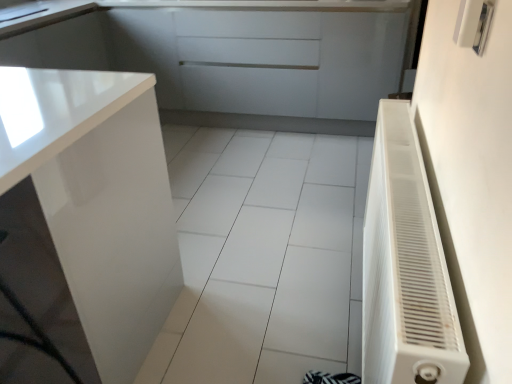
Question: Would you say glossy white cabinet at upper left, marked as the first cabinetry in a back-to-front arrangement, is to the left or to the right of metallic silver switch at upper right in the picture?

Choices:
 (A) right
 (B) left

Answer: (B)

Question: Based on their sizes in the image, would you say glossy white cabinet at upper left, placed as the 2th cabinetry when sorted from front to back, is bigger or smaller than metallic silver switch at upper right?

Choices:
 (A) small
 (B) big

Answer: (B)

Question: Estimate the real-world distances between objects in this image. Which object is closer to the white plastic radiator at right?

Choices:
 (A) glossy white cabinet at left, the 2th cabinetry when ordered from back to front
 (B) glossy white cabinet at upper left, marked as the first cabinetry in a back-to-front arrangement
 (C) metallic silver switch at upper right
 (D) white glossy tile at center
 (E) white glossy sink at upper left

Answer: (C)

Question: Considering the real-world distances, which object is closest to the white glossy tile at center?

Choices:
 (A) glossy white cabinet at left, arranged as the first cabinetry when ordered from the bottom
 (B) metallic silver switch at upper right
 (C) white plastic radiator at right
 (D) glossy white cabinet at upper left, the 1th cabinetry viewed from the top
 (E) white glossy sink at upper left

Answer: (A)